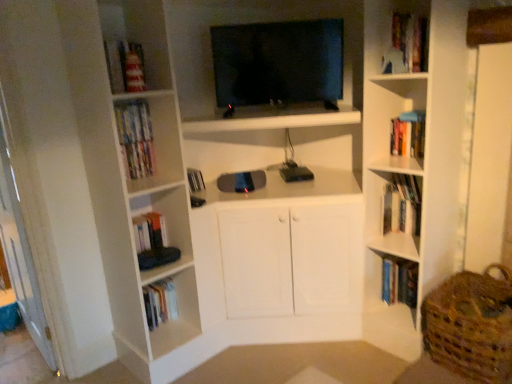
The height and width of the screenshot is (384, 512). Describe the element at coordinates (408, 187) in the screenshot. I see `hardcover book at upper right, placed as the third book when sorted from top to bottom` at that location.

Identify the location of hardcover book at upper right, marked as the second book in a right-to-left arrangement. This screenshot has height=384, width=512. (408, 187).

You are a GUI agent. You are given a task and a screenshot of the screen. Output one action in this format:
    pyautogui.click(x=<x>, y=<y>)
    Task: Click on the hardcover books at upper right, which is counted as the 5th book, starting from the left
    
    Given the screenshot: What is the action you would take?
    pyautogui.click(x=408, y=134)

What is the approximate width of hardcover books at upper right, placed as the 4th book when sorted from bottom to top?

hardcover books at upper right, placed as the 4th book when sorted from bottom to top, is 6.82 inches in width.

The height and width of the screenshot is (384, 512). Find the location of `hardcover books at right, marked as the fifth book in a top-to-bottom arrangement`. hardcover books at right, marked as the fifth book in a top-to-bottom arrangement is located at coordinates (399, 281).

How much space does hardcover books at right, which is counted as the first book, starting from the bottom, occupy vertically?

11.78 inches.

Image resolution: width=512 pixels, height=384 pixels. Describe the element at coordinates (471, 325) in the screenshot. I see `woven brown basket at lower right` at that location.

What is the approximate height of wooden bookshelf at upper right?

It is 30.21 centimeters.

Image resolution: width=512 pixels, height=384 pixels. Identify the location of wooden bookshelf at upper right. (402, 36).

Identify the location of matte plastic bookshelf at upper left, positioned as the first book in top-to-bottom order. The width and height of the screenshot is (512, 384). (133, 122).

Would you consider hardcover book at upper right, placed as the third book when sorted from top to bottom, to be distant from hardcover books at right, the third book positioned from the left?

That's not correct — hardcover book at upper right, placed as the third book when sorted from top to bottom, is a little close to hardcover books at right, the third book positioned from the left.

Which of these two, hardcover book at upper right, placed as the third book when sorted from top to bottom, or hardcover books at right, which is the third book from right to left, stands taller?

Standing taller between the two is hardcover books at right, which is the third book from right to left.

Does hardcover book at upper right, marked as the second book in a right-to-left arrangement, have a lesser width compared to hardcover books at right, marked as the fifth book in a top-to-bottom arrangement?

Indeed, hardcover book at upper right, marked as the second book in a right-to-left arrangement, has a lesser width compared to hardcover books at right, marked as the fifth book in a top-to-bottom arrangement.

Considering the sizes of objects hardcover book at upper right, marked as the second book in a right-to-left arrangement, and hardcover books at right, marked as the fifth book in a top-to-bottom arrangement, in the image provided, who is smaller, hardcover book at upper right, marked as the second book in a right-to-left arrangement, or hardcover books at right, marked as the fifth book in a top-to-bottom arrangement,?

With smaller size is hardcover book at upper right, marked as the second book in a right-to-left arrangement.

Is white matte book at upper right, which is the second book from left to right, far from hardcover books at right, which is counted as the first book, starting from the bottom?

They are positioned close to each other.

Looking at the image, does white matte book at upper right, which is the second book from left to right, seem bigger or smaller compared to hardcover books at right, which is counted as the first book, starting from the bottom?

Considering their sizes, white matte book at upper right, which is the second book from left to right, takes up less space than hardcover books at right, which is counted as the first book, starting from the bottom.

Considering the relative sizes of white matte book at upper right, which is the second book from left to right, and hardcover books at right, the third book positioned from the left, in the image provided, is white matte book at upper right, which is the second book from left to right, shorter than hardcover books at right, the third book positioned from the left,?

No.

Is white matte book at upper right, arranged as the fourth book when viewed from the right, turned away from hardcover books at right, which is counted as the first book, starting from the bottom?

That's not correct — white matte book at upper right, arranged as the fourth book when viewed from the right, is not looking away from hardcover books at right, which is counted as the first book, starting from the bottom.

From the image's perspective, is wooden bookshelf at upper right located above hardcover books at right, which is counted as the first book, starting from the bottom?

Correct, wooden bookshelf at upper right appears higher than hardcover books at right, which is counted as the first book, starting from the bottom, in the image.

Based on the photo, considering the positions of objects wooden bookshelf at upper right and hardcover books at right, marked as the fifth book in a top-to-bottom arrangement, in the image provided, who is more to the right, wooden bookshelf at upper right or hardcover books at right, marked as the fifth book in a top-to-bottom arrangement,?

Positioned to the right is hardcover books at right, marked as the fifth book in a top-to-bottom arrangement.

From a real-world perspective, is wooden bookshelf at upper right located higher than hardcover books at right, marked as the fifth book in a top-to-bottom arrangement?

Yes, from a real-world perspective, wooden bookshelf at upper right is on top of hardcover books at right, marked as the fifth book in a top-to-bottom arrangement.

Which is more distant, (404, 49) or (382, 284)?

Point (382, 284)

Considering the positions of objects black glossy tv at upper center and hardcover books at upper right, the 2th book when ordered from top to bottom, in the image provided, who is behind, black glossy tv at upper center or hardcover books at upper right, the 2th book when ordered from top to bottom,?

hardcover books at upper right, the 2th book when ordered from top to bottom, is more distant.

From the image's perspective, between black glossy tv at upper center and hardcover books at upper right, acting as the 1th book starting from the right, who is located below?

hardcover books at upper right, acting as the 1th book starting from the right, is shown below in the image.

Is hardcover books at upper right, the 2th book when ordered from top to bottom, surrounded by black glossy tv at upper center?

No, hardcover books at upper right, the 2th book when ordered from top to bottom, is not surrounded by black glossy tv at upper center.

Does black glossy tv at upper center have a greater height compared to hardcover books at upper right, placed as the 4th book when sorted from bottom to top?

Correct, black glossy tv at upper center is much taller as hardcover books at upper right, placed as the 4th book when sorted from bottom to top.

Relative to matte plastic bookshelf at upper left, which appears as the 5th book when viewed from the right, is woven brown basket at lower right in front or behind?

In the image, woven brown basket at lower right appears in front of matte plastic bookshelf at upper left, which appears as the 5th book when viewed from the right.

I want to click on basket below the matte plastic bookshelf at upper left, which appears as the 5th book when viewed from the right (from the image's perspective), so click(x=471, y=325).

Which of these two, woven brown basket at lower right or matte plastic bookshelf at upper left, which appears as the 5th book when viewed from the right, is smaller?

Smaller between the two is matte plastic bookshelf at upper left, which appears as the 5th book when viewed from the right.

From the image's perspective, is woven brown basket at lower right under matte plastic bookshelf at upper left, which appears as the fifth book when ordered from the bottom?

Correct, woven brown basket at lower right appears lower than matte plastic bookshelf at upper left, which appears as the fifth book when ordered from the bottom, in the image.

From a real-world perspective, does matte plastic bookshelf at upper left, which appears as the 5th book when viewed from the right, stand above black glossy tv at upper center?

No, from a real-world perspective, matte plastic bookshelf at upper left, which appears as the 5th book when viewed from the right, is not over black glossy tv at upper center

Could you tell me if matte plastic bookshelf at upper left, which appears as the fifth book when ordered from the bottom, is turned towards black glossy tv at upper center?

No, matte plastic bookshelf at upper left, which appears as the fifth book when ordered from the bottom, is not turned towards black glossy tv at upper center.

Between matte plastic bookshelf at upper left, the first book in the left-to-right sequence, and black glossy tv at upper center, which one is positioned in front?

matte plastic bookshelf at upper left, the first book in the left-to-right sequence, is more forward.

How different are the orientations of matte plastic bookshelf at upper left, positioned as the first book in top-to-bottom order, and black glossy tv at upper center in degrees?

42.1 degrees separate the facing orientations of matte plastic bookshelf at upper left, positioned as the first book in top-to-bottom order, and black glossy tv at upper center.

From a real-world perspective, which object stands above the other?

wooden bookshelf at upper right is physically above.

From the image's perspective, is matte plastic bookshelf at upper left, the first book in the left-to-right sequence, on top of wooden bookshelf at upper right?

No, from the image's perspective, matte plastic bookshelf at upper left, the first book in the left-to-right sequence, is not above wooden bookshelf at upper right.

How different are the orientations of matte plastic bookshelf at upper left, which appears as the 5th book when viewed from the right, and wooden bookshelf at upper right in degrees?

They differ by 87.9 degrees in their facing directions.

Consider the image. Is matte plastic bookshelf at upper left, positioned as the first book in top-to-bottom order, touching wooden bookshelf at upper right?

No, matte plastic bookshelf at upper left, positioned as the first book in top-to-bottom order, is not touching wooden bookshelf at upper right.

Find the location of a particular element. This screenshot has width=512, height=384. the 2nd book behind the hardcover book at upper right, placed as the third book when sorted from top to bottom is located at coordinates (399, 281).

The height and width of the screenshot is (384, 512). I want to click on book that is the 1st one above the hardcover books at right, marked as the fifth book in a top-to-bottom arrangement (from a real-world perspective), so click(402, 204).

In the scene shown: Considering their positions, is white matte book at upper right, the fourth book viewed from the top, positioned closer to hardcover books at upper right, the 2th book when ordered from top to bottom, than black glossy tv at upper center?

Among the two, white matte book at upper right, the fourth book viewed from the top, is located nearer to hardcover books at upper right, the 2th book when ordered from top to bottom.

Looking at the image, which one is located further to white matte book at upper right, which is the second book from left to right, woven brown basket at lower right or wooden bookshelf at upper right?

Among the two, wooden bookshelf at upper right is located further to white matte book at upper right, which is the second book from left to right.

From the image, which object appears to be farther from wooden bookshelf at upper right, hardcover books at upper right, the 2th book when ordered from top to bottom, or woven brown basket at lower right?

woven brown basket at lower right lies further to wooden bookshelf at upper right than the other object.

Estimate the real-world distances between objects in this image. Which object is closer to white matte book at upper right, arranged as the fourth book when viewed from the right, wooden bookshelf at upper right or hardcover book at upper right, placed as the third book when sorted from top to bottom?

hardcover book at upper right, placed as the third book when sorted from top to bottom, is closer to white matte book at upper right, arranged as the fourth book when viewed from the right.

Which object lies further to the anchor point hardcover books at right, marked as the fifth book in a top-to-bottom arrangement, matte plastic bookshelf at upper left, which appears as the fifth book when ordered from the bottom, or hardcover book at upper right, placed as the third book when sorted from top to bottom?

matte plastic bookshelf at upper left, which appears as the fifth book when ordered from the bottom, is positioned further to the anchor hardcover books at right, marked as the fifth book in a top-to-bottom arrangement.

From the image, which object appears to be farther from matte plastic bookshelf at upper left, which appears as the 5th book when viewed from the right, hardcover books at right, the third book positioned from the left, or wooden bookshelf at upper right?

hardcover books at right, the third book positioned from the left, lies further to matte plastic bookshelf at upper left, which appears as the 5th book when viewed from the right, than the other object.

Looking at the image, which one is located closer to woven brown basket at lower right, matte plastic bookshelf at upper left, which appears as the fifth book when ordered from the bottom, or hardcover books at right, the third book positioned from the left?

hardcover books at right, the third book positioned from the left, is positioned closer to the anchor woven brown basket at lower right.

From the image, which object appears to be nearer to hardcover books at right, which is the third book from right to left, hardcover book at upper right, marked as the second book in a right-to-left arrangement, or woven brown basket at lower right?

woven brown basket at lower right lies closer to hardcover books at right, which is the third book from right to left, than the other object.

The image size is (512, 384). I want to click on television between wooden bookshelf at upper right and hardcover books at right, the third book positioned from the left, in the up-down direction, so click(278, 62).

Image resolution: width=512 pixels, height=384 pixels. I want to click on cabinet situated between black glossy tv at upper center and hardcover books at upper right, placed as the 4th book when sorted from bottom to top, from left to right, so click(402, 36).

I want to click on television between wooden bookshelf at upper right and woven brown basket at lower right from top to bottom, so click(x=278, y=62).

Locate an element on the screen. television located between matte plastic bookshelf at upper left, positioned as the first book in top-to-bottom order, and woven brown basket at lower right in the left-right direction is located at coordinates (278, 62).